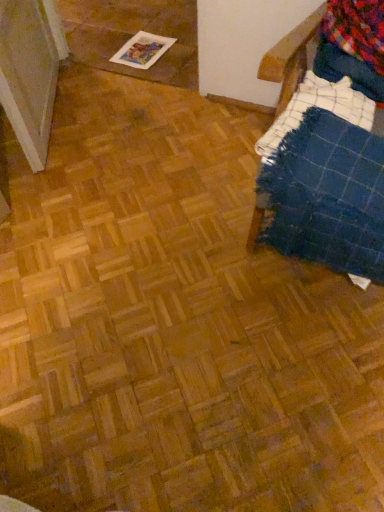
Where is `vacant space behind printed paper magazine at upper left`? This screenshot has height=512, width=384. vacant space behind printed paper magazine at upper left is located at coordinates (146, 29).